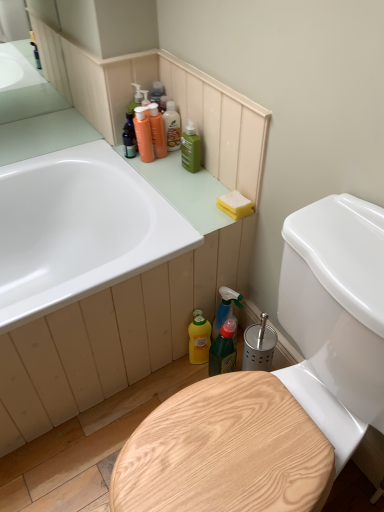
Question: From the image's perspective, is yellow sponge at upper right under green matte bottle at upper center, the 4th cleaning product positioned from the top?

Choices:
 (A) yes
 (B) no

Answer: (A)

Question: From a real-world perspective, is yellow sponge at upper right on top of green matte bottle at upper center, the 4th cleaning product positioned from the top?

Choices:
 (A) no
 (B) yes

Answer: (A)

Question: Is green matte bottle at upper center, the 4th cleaning product positioned from the top, at the back of yellow sponge at upper right?

Choices:
 (A) no
 (B) yes

Answer: (A)

Question: Is yellow sponge at upper right further to camera compared to green matte bottle at upper center, the 4th cleaning product positioned from the top?

Choices:
 (A) no
 (B) yes

Answer: (A)

Question: Would you say yellow sponge at upper right contains green matte bottle at upper center, which is the third cleaning product from bottom to top?

Choices:
 (A) yes
 (B) no

Answer: (B)

Question: From the image's perspective, is translucent amber bottle at upper center, which is the sixth cleaning product from bottom to top, positioned above or below yellow matte bottle at lower center, which is counted as the 6th cleaning product, starting from the top?

Choices:
 (A) below
 (B) above

Answer: (B)

Question: In the image, is translucent amber bottle at upper center, which is the sixth cleaning product from bottom to top, positioned in front of or behind yellow matte bottle at lower center, which is counted as the 6th cleaning product, starting from the top?

Choices:
 (A) front
 (B) behind

Answer: (B)

Question: Considering the positions of point (165, 110) and point (190, 353), is point (165, 110) closer or farther from the camera than point (190, 353)?

Choices:
 (A) farther
 (B) closer

Answer: (A)

Question: Choose the correct answer: Is translucent amber bottle at upper center, which is the sixth cleaning product from bottom to top, inside yellow matte bottle at lower center, the first cleaning product when ordered from bottom to top, or outside it?

Choices:
 (A) outside
 (B) inside

Answer: (A)

Question: Considering the positions of yellow matte bottle at lower center, the first cleaning product when ordered from bottom to top, and green plastic spray bottle at lower center in the image, is yellow matte bottle at lower center, the first cleaning product when ordered from bottom to top, taller or shorter than green plastic spray bottle at lower center?

Choices:
 (A) tall
 (B) short

Answer: (B)

Question: Is point (198, 325) closer or farther from the camera than point (230, 340)?

Choices:
 (A) farther
 (B) closer

Answer: (A)

Question: From the image's perspective, is yellow matte bottle at lower center, the first cleaning product when ordered from bottom to top, positioned above or below green plastic spray bottle at lower center?

Choices:
 (A) below
 (B) above

Answer: (B)

Question: Is yellow matte bottle at lower center, which is counted as the 6th cleaning product, starting from the top, inside the boundaries of green plastic spray bottle at lower center, or outside?

Choices:
 (A) inside
 (B) outside

Answer: (B)

Question: From the image's perspective, relative to translucent green spray bottle at lower right, which ranks as the 5th cleaning product in top-to-bottom order, is green plastic spray bottle at lower center above or below?

Choices:
 (A) below
 (B) above

Answer: (A)

Question: From a real-world perspective, relative to translucent green spray bottle at lower right, which ranks as the 5th cleaning product in top-to-bottom order, is green plastic spray bottle at lower center vertically above or below?

Choices:
 (A) below
 (B) above

Answer: (B)